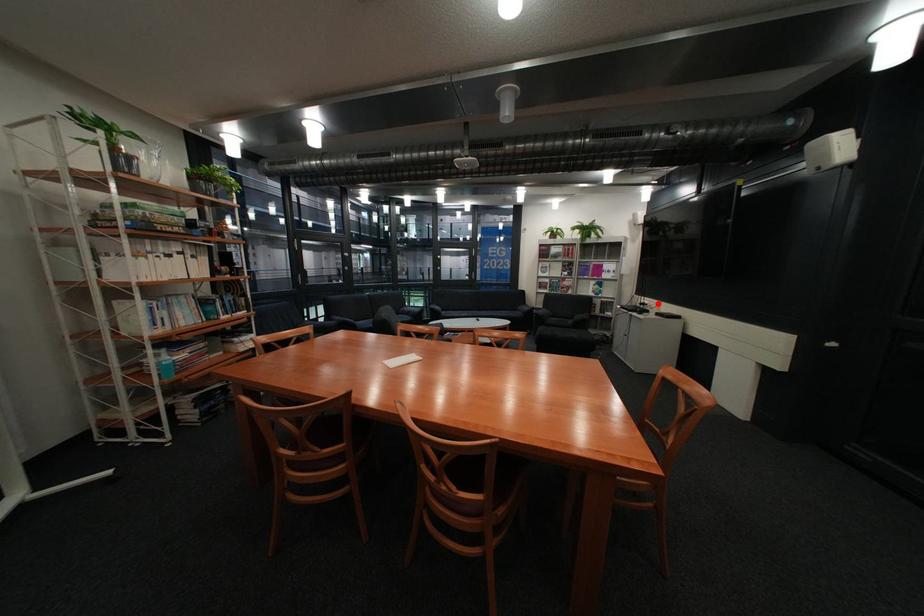
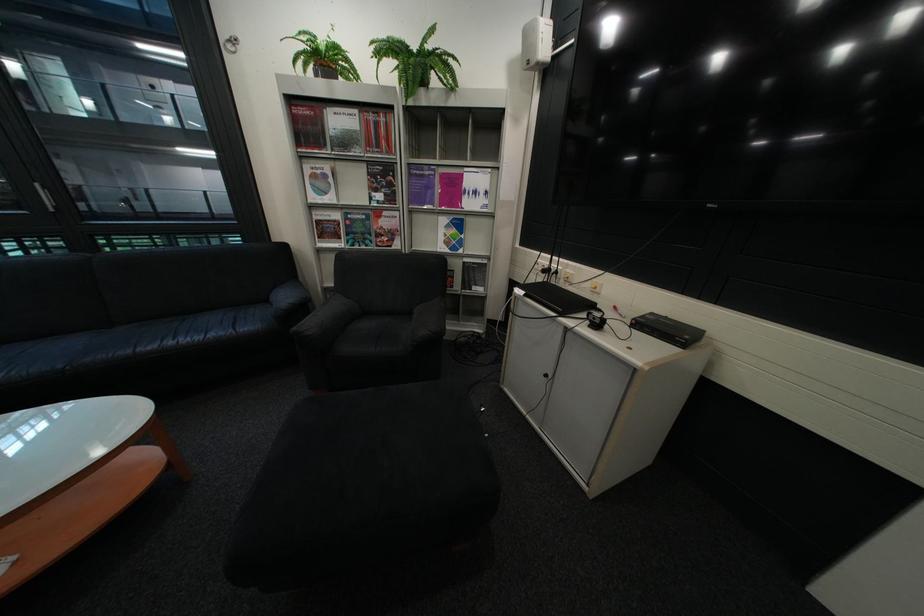
In the second image, find the point that corresponds to the highlighted location in the first image.

(563, 270)